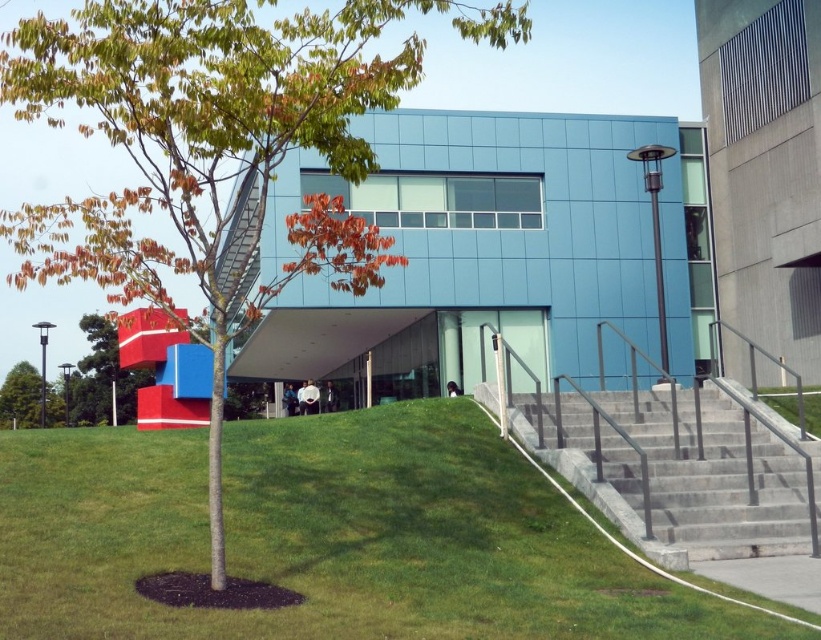
Question: Which of the following is the farthest from the observer?

Choices:
 (A) gray concrete stairs at lower right
 (B) green leafy tree at center

Answer: (A)

Question: Among these objects, which one is nearest to the camera?

Choices:
 (A) smooth red cube at left
 (B) gray concrete stairs at lower right
 (C) green grassy at lower left
 (D) green leafy tree at center

Answer: (C)

Question: Does green leafy tree at center have a smaller size compared to green leafy tree at left?

Choices:
 (A) yes
 (B) no

Answer: (B)

Question: In this image, where is gray concrete stairs at lower right located relative to smooth red cube at left?

Choices:
 (A) right
 (B) left

Answer: (A)

Question: In this image, where is green grassy at lower left located relative to smooth red cube at left?

Choices:
 (A) above
 (B) below

Answer: (A)

Question: Among these objects, which one is farthest from the camera?

Choices:
 (A) gray concrete stairs at lower right
 (B) green leafy tree at center
 (C) smooth red cube at left

Answer: (C)